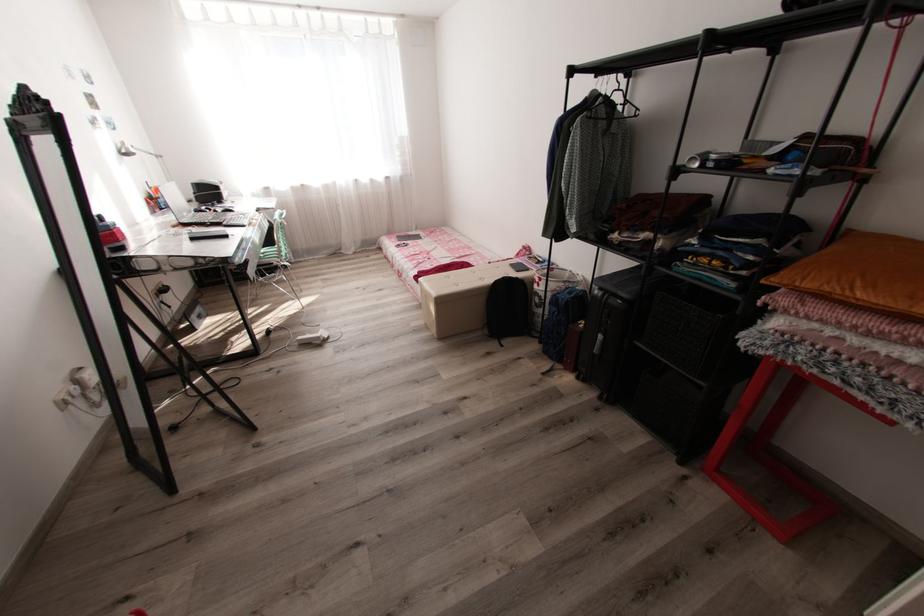
Describe the element at coordinates (175, 200) in the screenshot. This screenshot has width=924, height=616. I see `the silver laptop` at that location.